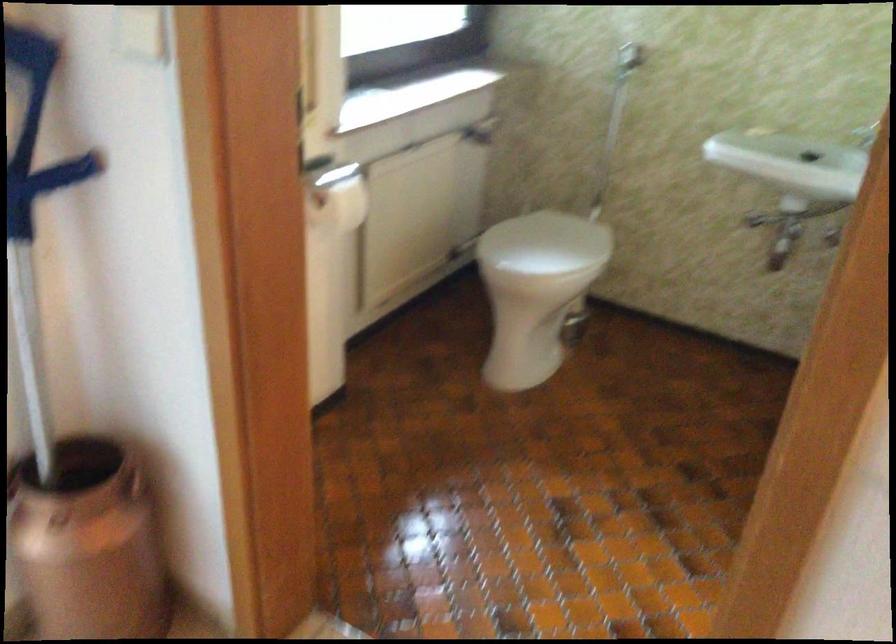
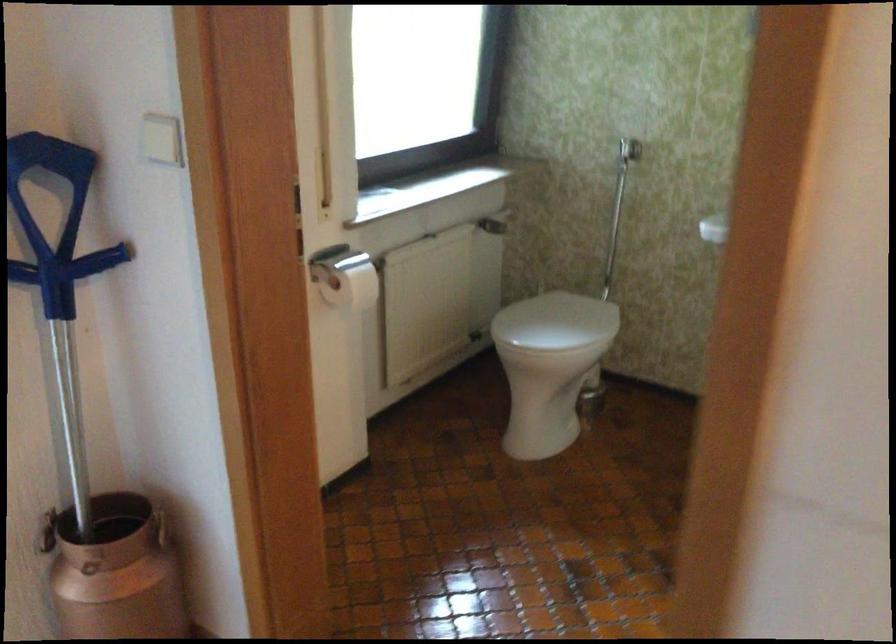
What movement of the cameraman would produce the second image?

The cameraman moved toward right, backward.